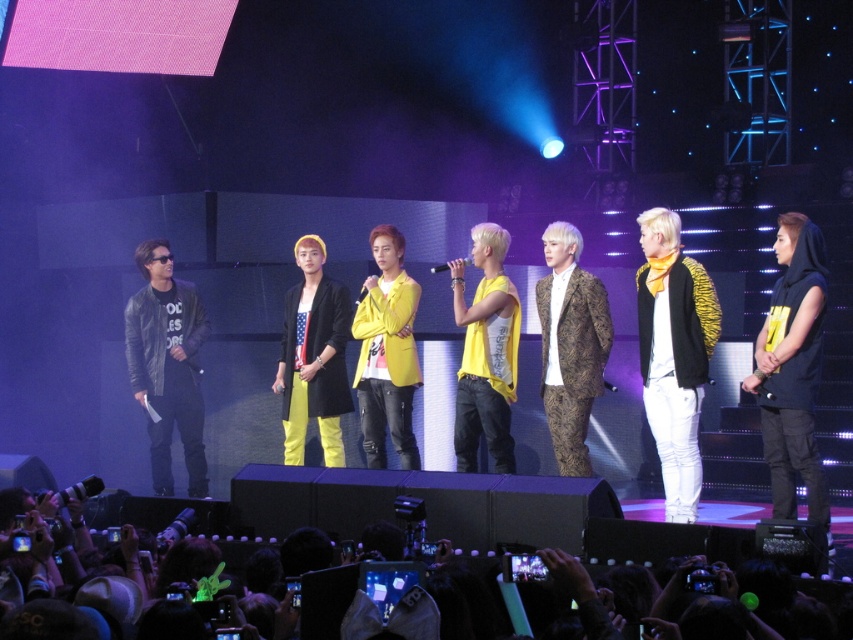
Is brown textured suit at center closer to camera compared to yellow matte jacket at center?

Yes, it is in front of yellow matte jacket at center.

Is brown textured suit at center below yellow matte jacket at center?

Yes.

Which is in front, point (547, 333) or point (393, 317)?

Point (547, 333)

The image size is (853, 640). In order to click on brown textured suit at center in this screenshot , I will do `click(570, 346)`.

Who is taller, yellow matte tank top at center or yellow fabric jacket at center?

yellow matte tank top at center

Who is positioned more to the right, yellow matte tank top at center or yellow fabric jacket at center?

yellow matte tank top at center is more to the right.

You are a GUI agent. You are given a task and a screenshot of the screen. Output one action in this format:
    pyautogui.click(x=<x>, y=<y>)
    Task: Click on the yellow matte tank top at center
    
    Given the screenshot: What is the action you would take?
    pyautogui.click(x=485, y=353)

Where is `yellow matte tank top at center`? yellow matte tank top at center is located at coordinates (485, 353).

Find the location of a particular element. The width and height of the screenshot is (853, 640). black jersey at center is located at coordinates (792, 371).

Which is more to the right, black jersey at center or brown textured suit at center?

From the viewer's perspective, black jersey at center appears more on the right side.

Who is more forward, [796,372] or [589,308]?

Point [796,372]

Locate an element on the screen. black jersey at center is located at coordinates (792, 371).